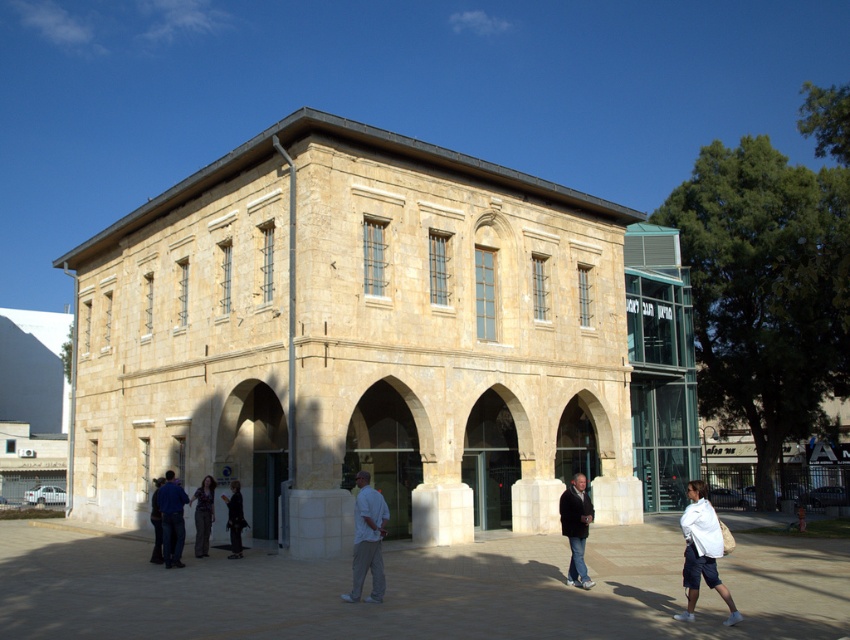
Question: Which object is positioned closest to the dark blue jeans at center?

Choices:
 (A) stone archway at center
 (B) white cotton shirt at lower right
 (C) denim pants at lower left
 (D) dark blue jeans at lower left

Answer: (C)

Question: Does beige stone archway at center appear under white cotton shirt at center?

Choices:
 (A) no
 (B) yes

Answer: (B)

Question: Which point is farther to the camera?

Choices:
 (A) (355, 579)
 (B) (496, 499)

Answer: (B)

Question: Considering the real-world distances, which object is closest to the dark gray jacket at center?

Choices:
 (A) white cotton shirt at center
 (B) white cotton shirt at lower right

Answer: (B)

Question: Is dark gray jacket at center positioned behind denim pants at lower left?

Choices:
 (A) yes
 (B) no

Answer: (B)

Question: Does white cotton shirt at lower right have a lesser width compared to blue denim jacket at lower left?

Choices:
 (A) no
 (B) yes

Answer: (A)